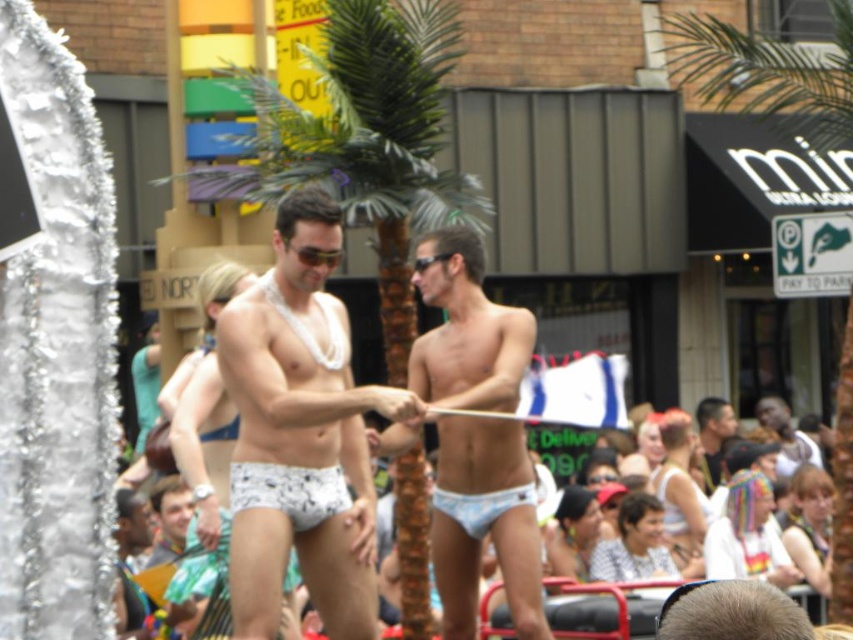
What is the color of the clothing item located at the coordinates point (786, 436)?

The light blue fabric shorts at center is represented by point (786, 436).

You are a photographer trying to capture a clear shot of both the light blue fabric shorts at center and the smooth skin head at center. Which object should you focus on first to ensure it appears sharp in your photo?

You should focus on the light blue fabric shorts at center first because it is closer to you than the smooth skin head at center, ensuring it stays sharp before adjusting focus for the latter.

You are a photographer trying to capture a closeup shot of the white printed underwear at center and the light blue fabric shorts at center. Which of the two items would require you to move closer to the subject to get a clear photo?

The white printed underwear at center has a smaller size compared to light blue fabric shorts at center, so you would need to move closer to the white printed underwear at center to capture it clearly.